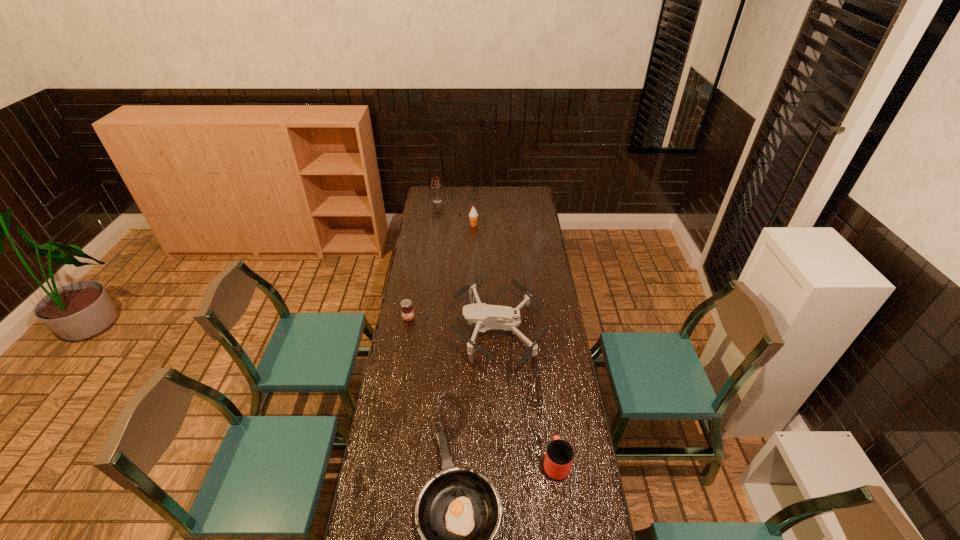
Where is `the tallest object`? This screenshot has height=540, width=960. the tallest object is located at coordinates (436, 185).

Where is `wineglass`? This screenshot has height=540, width=960. wineglass is located at coordinates [x=436, y=185].

Identify the location of the fifth nearest object. The width and height of the screenshot is (960, 540). (473, 215).

Locate an element on the screen. This screenshot has width=960, height=540. drone is located at coordinates (485, 317).

In order to click on cup in this screenshot , I will do `click(559, 455)`.

Locate an element on the screen. This screenshot has height=540, width=960. jam is located at coordinates (407, 311).

Image resolution: width=960 pixels, height=540 pixels. In order to click on free space located on the right of the farthest object in this screenshot , I will do `click(459, 201)`.

Find the location of `vacant space located on the right of the fifth nearest object`. vacant space located on the right of the fifth nearest object is located at coordinates (518, 225).

Where is `vacant space situated 0.180m with a camera at the front of the drone`? The image size is (960, 540). vacant space situated 0.180m with a camera at the front of the drone is located at coordinates (411, 329).

Where is `vacant space located 0.150m with a camera at the front of the drone`? This screenshot has width=960, height=540. vacant space located 0.150m with a camera at the front of the drone is located at coordinates tap(418, 329).